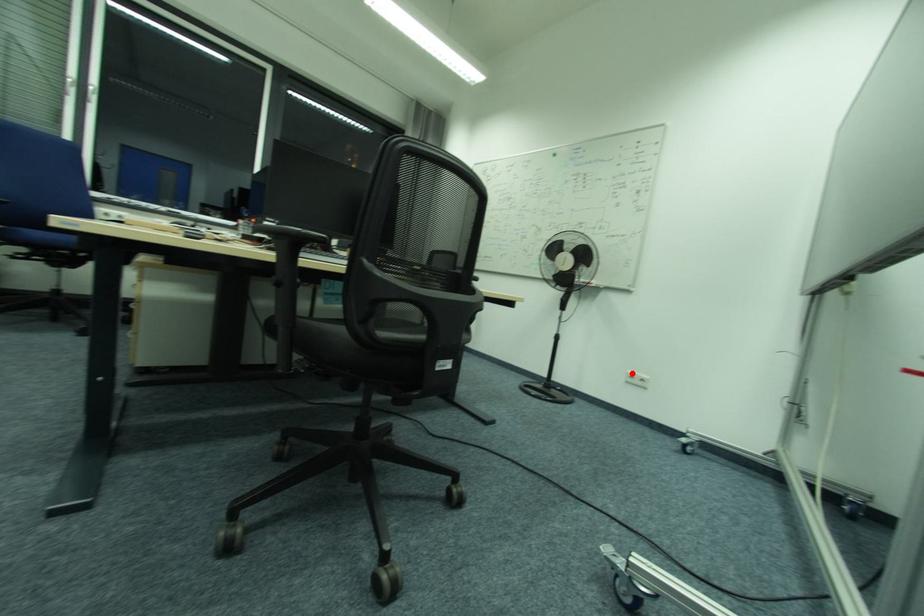
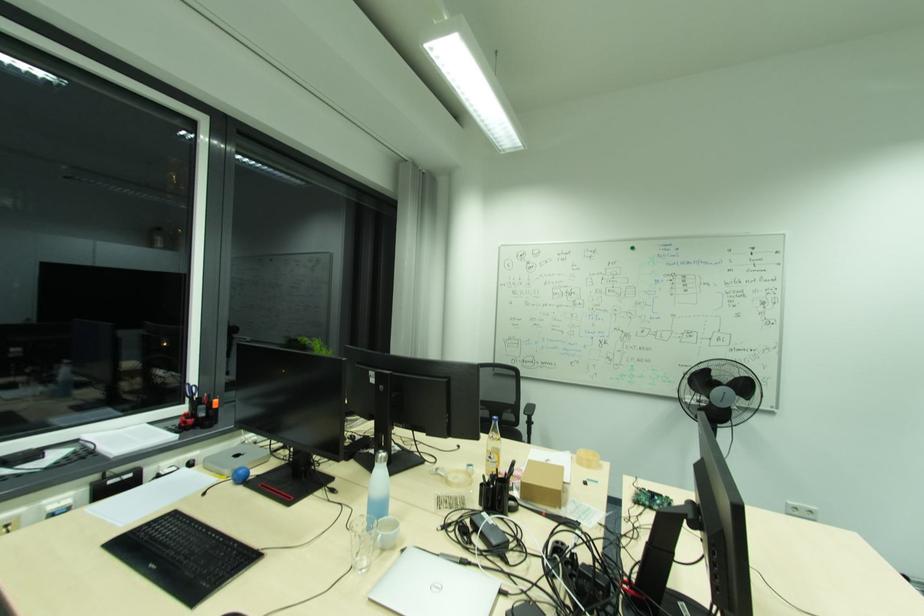
Locate, in the second image, the point that corresponds to the highlighted location in the first image.

(794, 506)